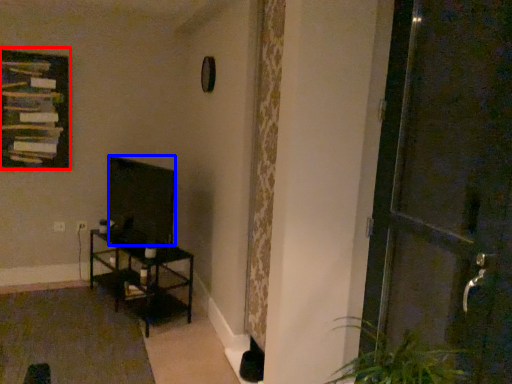
Question: Which of the following is the farthest to the observer, picture frame (highlighted by a red box) or wide (highlighted by a blue box)?

Choices:
 (A) picture frame
 (B) wide

Answer: (A)